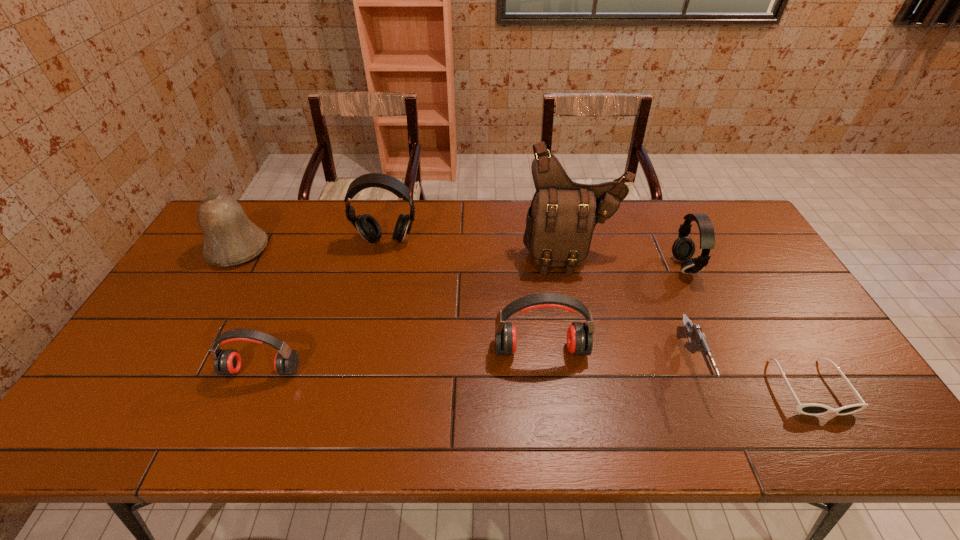
Image resolution: width=960 pixels, height=540 pixels. I want to click on object at the far left corner, so click(230, 238).

Locate an element on the screen. The image size is (960, 540). object located in the near right corner section of the desktop is located at coordinates (810, 408).

The width and height of the screenshot is (960, 540). I want to click on vacant space at the far edge of the desktop, so click(x=294, y=240).

You are a GUI agent. You are given a task and a screenshot of the screen. Output one action in this format:
    pyautogui.click(x=<x>, y=<y>)
    Task: Click on the vacant space at the left edge of the desktop
    
    Given the screenshot: What is the action you would take?
    pyautogui.click(x=226, y=268)

At what (x,y) coordinates should I click in order to perform the action: click on vacant point at the far right corner. Please return your answer as a coordinate pair (x, y). Image resolution: width=960 pixels, height=540 pixels. Looking at the image, I should click on (683, 200).

Where is `vacant space at the near right corner`? This screenshot has height=540, width=960. vacant space at the near right corner is located at coordinates (865, 440).

At what (x,y) coordinates should I click in order to perform the action: click on vacant area between the leftmost earphone and the third object from right to left. Please return your answer as a coordinate pair (x, y). This screenshot has height=540, width=960. Looking at the image, I should click on (475, 367).

The width and height of the screenshot is (960, 540). In order to click on vacant area between the black sunglasses and the sixth tallest object in this screenshot , I will do `click(536, 379)`.

Find the location of a particular element. The height and width of the screenshot is (540, 960). empty space that is in between the tallest object and the smaller black earphone is located at coordinates (628, 261).

The image size is (960, 540). In order to click on free point between the rightmost earphone and the brown shoulder bag in this screenshot , I will do `click(628, 261)`.